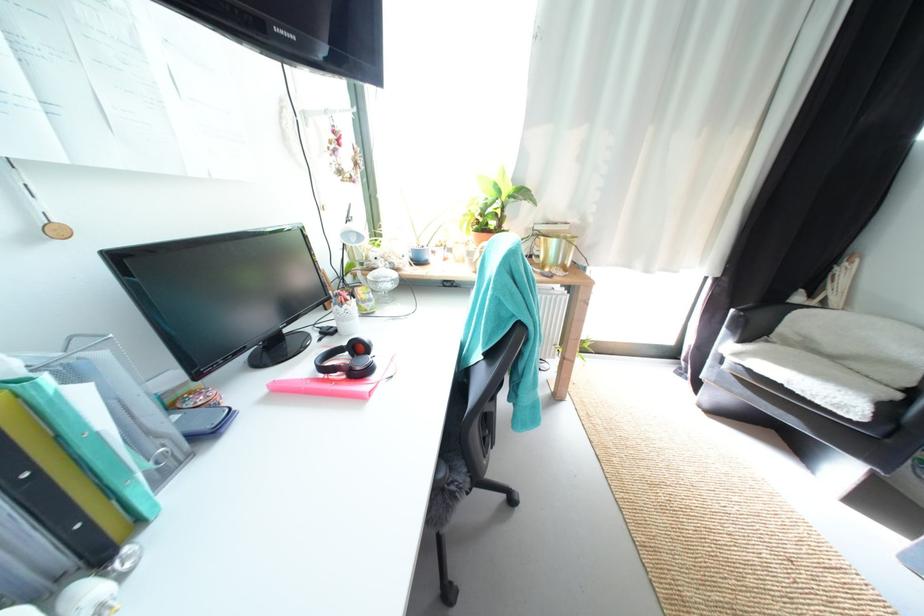
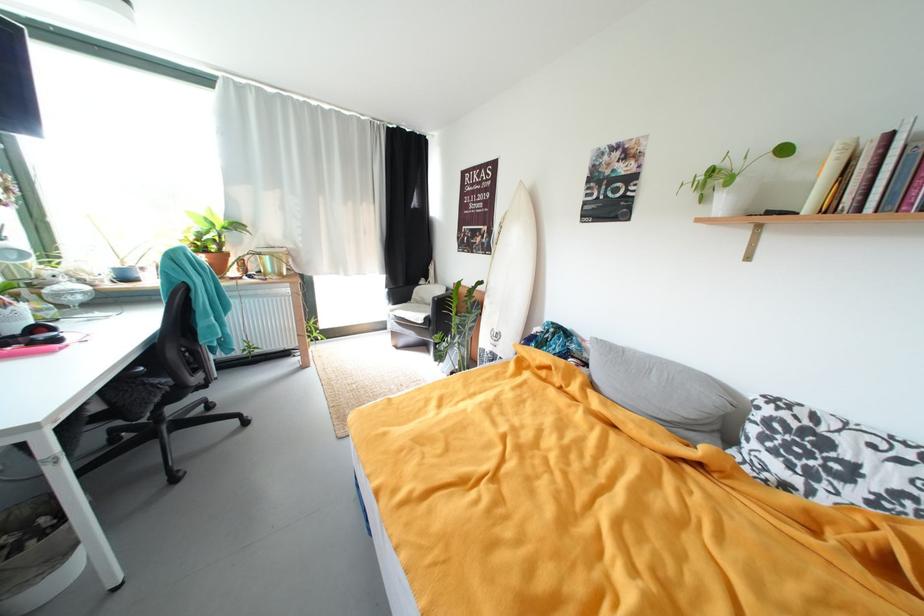
Where in the second image is the point corresponding to pixel 507 193 from the first image?

(221, 225)